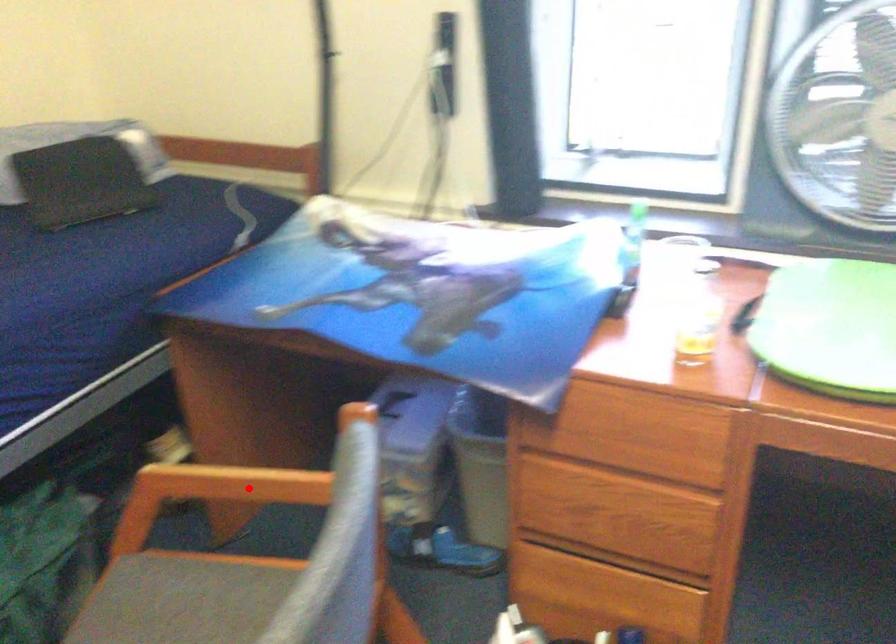
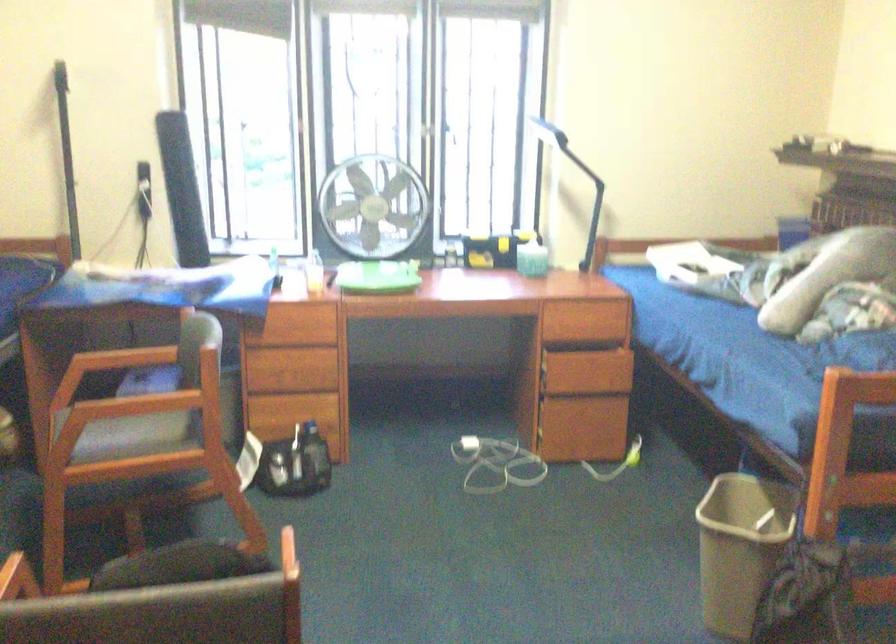
The point at the highlighted location is marked in the first image. Where is the corresponding point in the second image?

(128, 357)